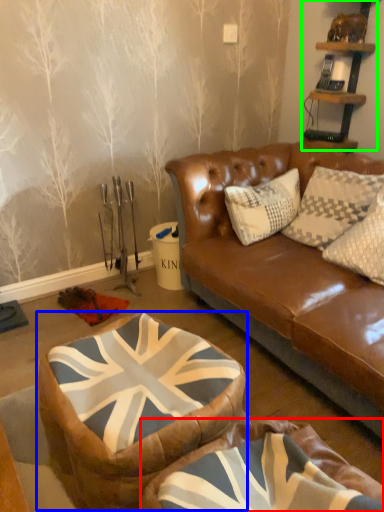
Question: Which object is the farthest from bean bag chair (highlighted by a red box)? Choose among these: bean bag chair (highlighted by a blue box) or shelf (highlighted by a green box).

Choices:
 (A) bean bag chair
 (B) shelf

Answer: (B)